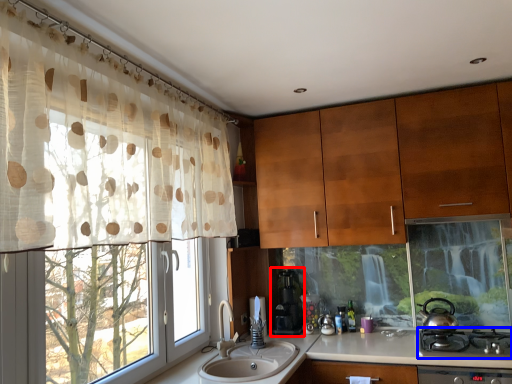
Question: Which object appears farthest to the camera in this image, coffee machine (highlighted by a red box) or gas stove (highlighted by a blue box)?

Choices:
 (A) coffee machine
 (B) gas stove

Answer: (A)